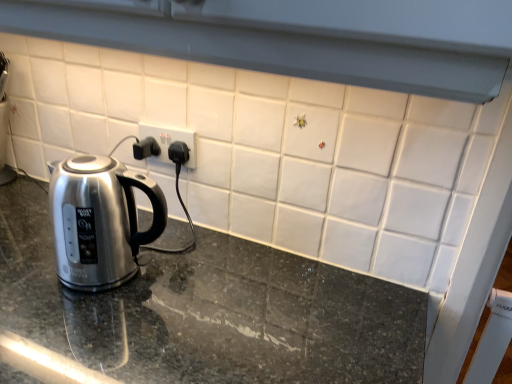
Question: Is the surface of granite countertop at center in direct contact with white plastic electric outlet at center?

Choices:
 (A) yes
 (B) no

Answer: (B)

Question: Are granite countertop at center and white plastic electric outlet at center far apart?

Choices:
 (A) no
 (B) yes

Answer: (A)

Question: Can you confirm if granite countertop at center is positioned to the left of white plastic electric outlet at center?

Choices:
 (A) yes
 (B) no

Answer: (B)

Question: Is granite countertop at center bigger than white plastic electric outlet at center?

Choices:
 (A) no
 (B) yes

Answer: (B)

Question: Is granite countertop at center positioned in front of white plastic electric outlet at center?

Choices:
 (A) no
 (B) yes

Answer: (B)

Question: Is satin metallic kettle at left bigger or smaller than white plastic electric outlet at center?

Choices:
 (A) small
 (B) big

Answer: (B)

Question: In the image, is satin metallic kettle at left positioned in front of or behind white plastic electric outlet at center?

Choices:
 (A) front
 (B) behind

Answer: (A)

Question: Considering the positions of satin metallic kettle at left and white plastic electric outlet at center in the image, is satin metallic kettle at left wider or thinner than white plastic electric outlet at center?

Choices:
 (A) thin
 (B) wide

Answer: (B)

Question: Visually, is satin metallic kettle at left positioned to the left or to the right of white plastic electric outlet at center?

Choices:
 (A) right
 (B) left

Answer: (B)

Question: Would you say white plastic electric outlet at center is inside or outside granite countertop at center?

Choices:
 (A) inside
 (B) outside

Answer: (B)

Question: From a real-world perspective, is white plastic electric outlet at center physically located above or below granite countertop at center?

Choices:
 (A) above
 (B) below

Answer: (A)

Question: From the image's perspective, relative to granite countertop at center, is white plastic electric outlet at center above or below?

Choices:
 (A) above
 (B) below

Answer: (A)

Question: In the image, is white plastic electric outlet at center positioned in front of or behind granite countertop at center?

Choices:
 (A) front
 (B) behind

Answer: (B)

Question: Is granite countertop at center taller or shorter than white plastic electric outlet at center?

Choices:
 (A) short
 (B) tall

Answer: (B)

Question: From a real-world perspective, is granite countertop at center above or below white plastic electric outlet at center?

Choices:
 (A) above
 (B) below

Answer: (B)